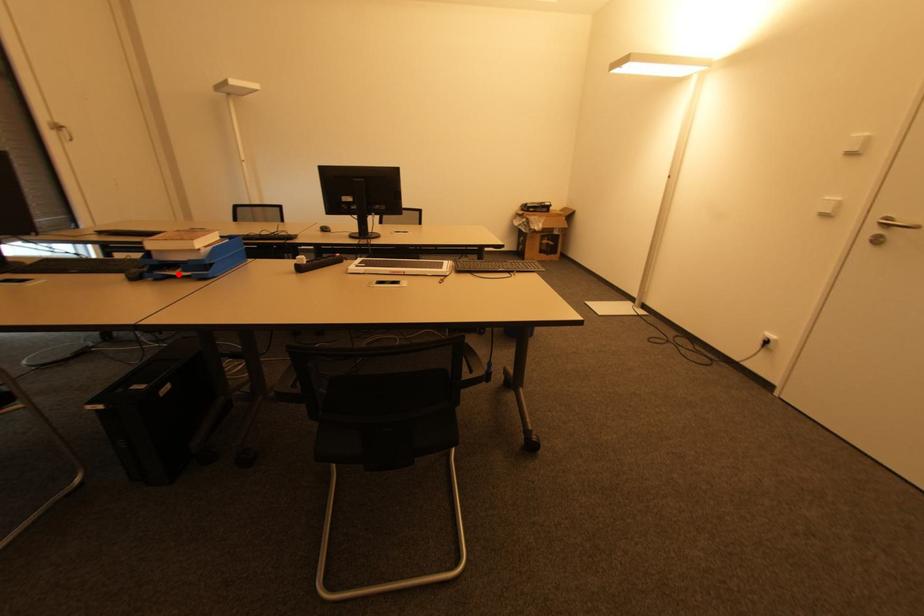
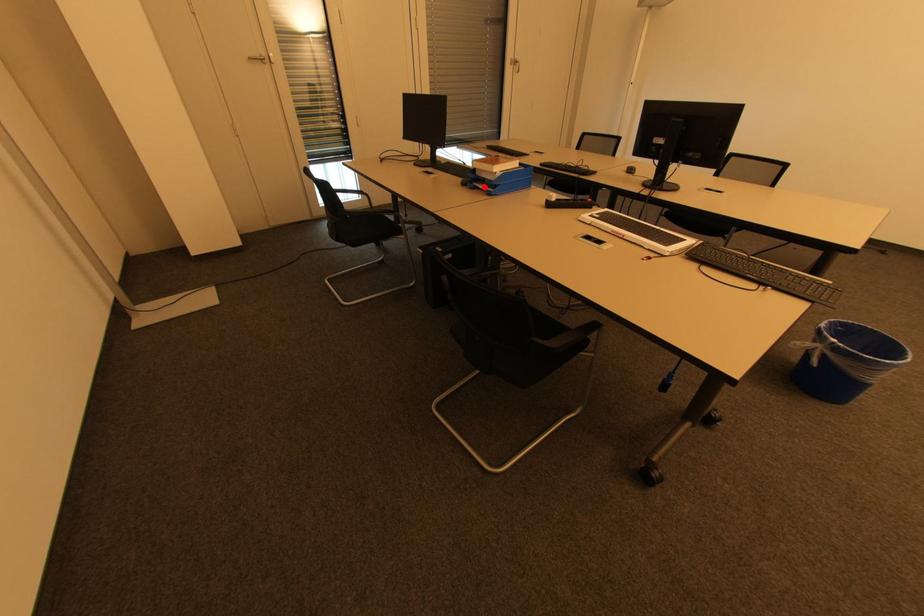
I am providing you with two images of the same scene from different viewpoints. A red point is marked on the first image and another point is marked on the second image. Does the point marked in image1 correspond to the same location as the one in image2?

Yes